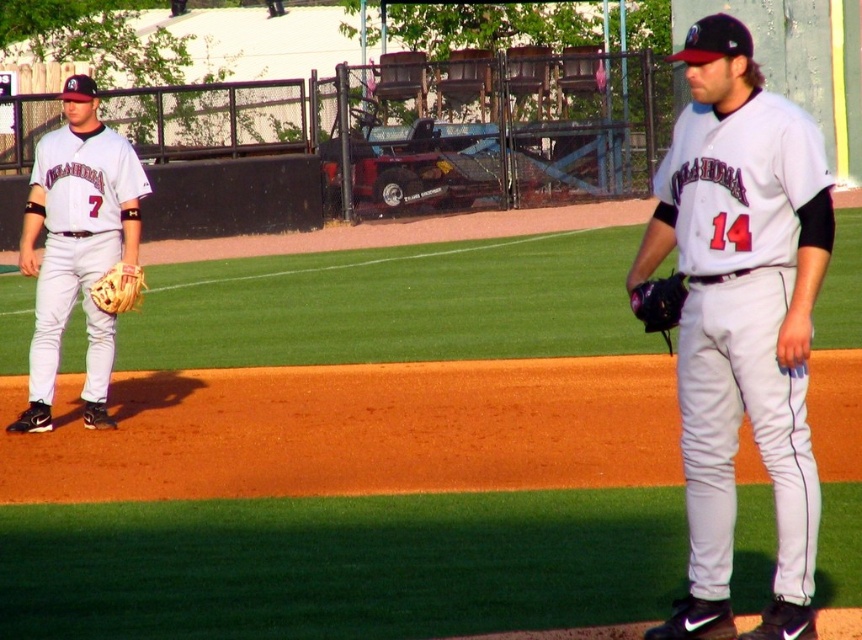
Does dark brown leather glove at right have a lesser height compared to brown leather glove at left?

Yes.

Is dark brown leather glove at right to the right of brown leather glove at left from the viewer's perspective?

Indeed, dark brown leather glove at right is positioned on the right side of brown leather glove at left.

Locate an element on the screen. Image resolution: width=862 pixels, height=640 pixels. dark brown leather glove at right is located at coordinates (659, 301).

Identify the location of dark brown leather glove at right. This screenshot has height=640, width=862. (659, 301).

Which is more to the right, white matte baseball uniform at center or dark brown leather glove at right?

white matte baseball uniform at center is more to the right.

This screenshot has width=862, height=640. I want to click on white matte baseball uniform at center, so click(x=741, y=320).

Does point (791, 224) come in front of point (648, 280)?

Yes, it is in front of point (648, 280).

Identify the location of white matte baseball uniform at center. (741, 320).

Which is below, white matte baseball uniform at center or matte white uniform at left?

white matte baseball uniform at center is below.

Is white matte baseball uniform at center wider than matte white uniform at left?

Incorrect, white matte baseball uniform at center's width does not surpass matte white uniform at left's.

Does point (771, 209) come closer to viewer compared to point (92, 328)?

Yes, point (771, 209) is in front of point (92, 328).

Find the location of a particular element. The height and width of the screenshot is (640, 862). white matte baseball uniform at center is located at coordinates (741, 320).